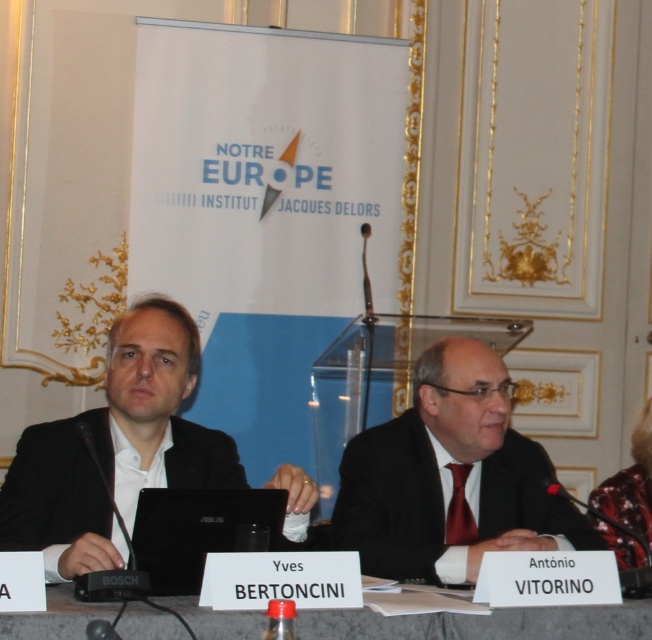
You are organizing a virtual meeting and need to ensure that the black matte laptop at center and the floral silk blouse at right are both visible in the frame. Which object should be placed closer to the camera to prioritize visibility?

The black matte laptop at center should be moved closer to the camera since it is positioned on the left side of the floral silk blouse at right, making it farther from the camera. Moving it closer would ensure both are visible.

You are organizing a presentation and need to place a laptop between the white paper at center and the floral silk blouse at right. Considering their sizes, which object should be placed closer to the edge of the table to accommodate the laptop?

The white paper at center is wider than the floral silk blouse at right, so the floral silk blouse at right should be moved closer to the edge of the table to make space for the laptop between them.

Looking at this image, you are organizing a presentation and need to place both the black matte laptop at center and the floral silk blouse at right on a desk. Considering their sizes, which object will require more horizontal space on the desk?

The black matte laptop at center requires more horizontal space because its width is larger than that of the floral silk blouse at right.